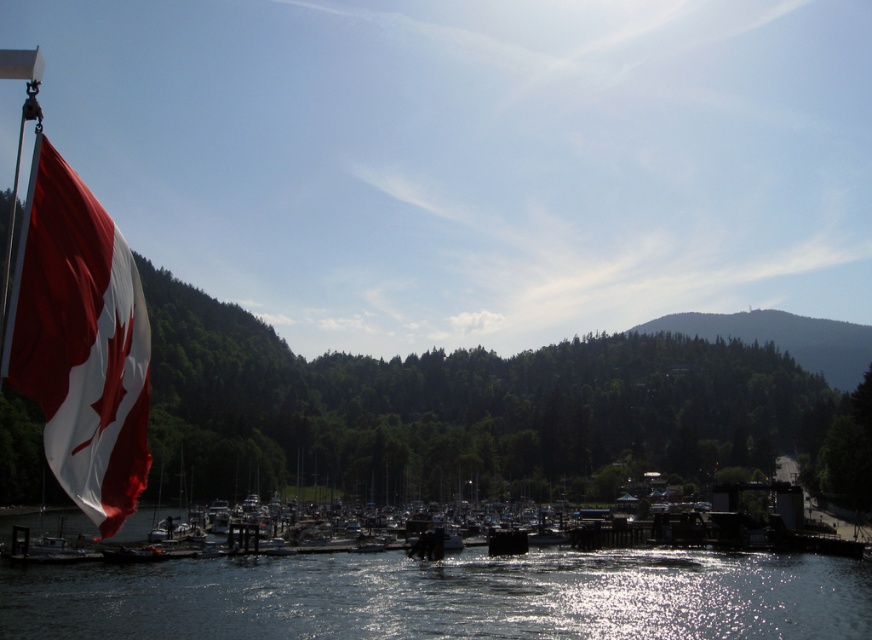
Based on the photo, you are standing at the waterfront and want to take a photo of the transparent water at center and the red fabric flag at left. Which object should you focus on first to ensure it appears sharp in your photo?

You should focus on the red fabric flag at left first because it is closer to you than the transparent water at center, which is further away. This ensures the flag will be in focus before adjusting for the water.

You are standing at the waterfront and want to take a photo that includes both the Canadian flag and the boats in the marina. Which point, point (594, 556) or point (133, 362), should you focus on to ensure both the Canadian flag and the boats are in focus?

To ensure both the Canadian flag and the boats in the marina are in focus, you should focus on point (133, 362) because it is closer to the camera than point (594, 556), allowing for a greater depth of field to capture both foreground and middle ground elements.